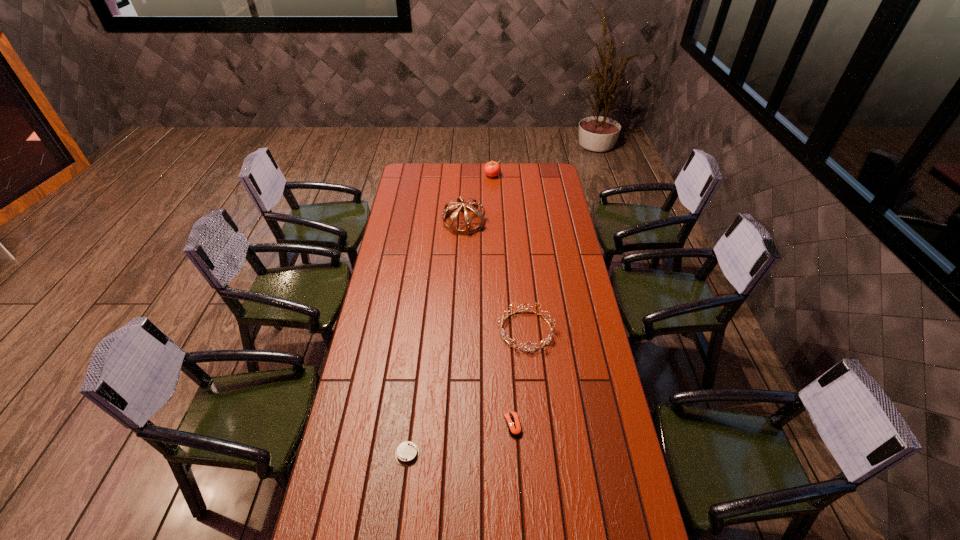
Locate an element on the screen. The image size is (960, 540). vacant region at the right edge of the desktop is located at coordinates (545, 233).

Identify the location of free space between the left tiara and the computer mouse. (489, 323).

Where is `free space between the fourth farthest object and the farthest object`? free space between the fourth farthest object and the farthest object is located at coordinates (502, 300).

Locate an element on the screen. vacant area between the nearest object and the fourth shortest object is located at coordinates (449, 315).

Where is `empty space that is in between the left tiara and the shortest object`? The width and height of the screenshot is (960, 540). empty space that is in between the left tiara and the shortest object is located at coordinates (436, 338).

The image size is (960, 540). Find the location of `free spot between the fourth tallest object and the tomato`. free spot between the fourth tallest object and the tomato is located at coordinates (502, 300).

Where is `free point between the computer mouse and the chocolate cake`? free point between the computer mouse and the chocolate cake is located at coordinates (460, 440).

Locate an element on the screen. The width and height of the screenshot is (960, 540). vacant space that is in between the computer mouse and the nearer tiara is located at coordinates (519, 377).

This screenshot has width=960, height=540. Find the location of `vacant area that lies between the fourth nearest object and the third farthest object`. vacant area that lies between the fourth nearest object and the third farthest object is located at coordinates (494, 276).

At what (x,y) coordinates should I click in order to perform the action: click on empty space between the nearer tiara and the fourth nearest object. Please return your answer as a coordinate pair (x, y). The image size is (960, 540). Looking at the image, I should click on (494, 276).